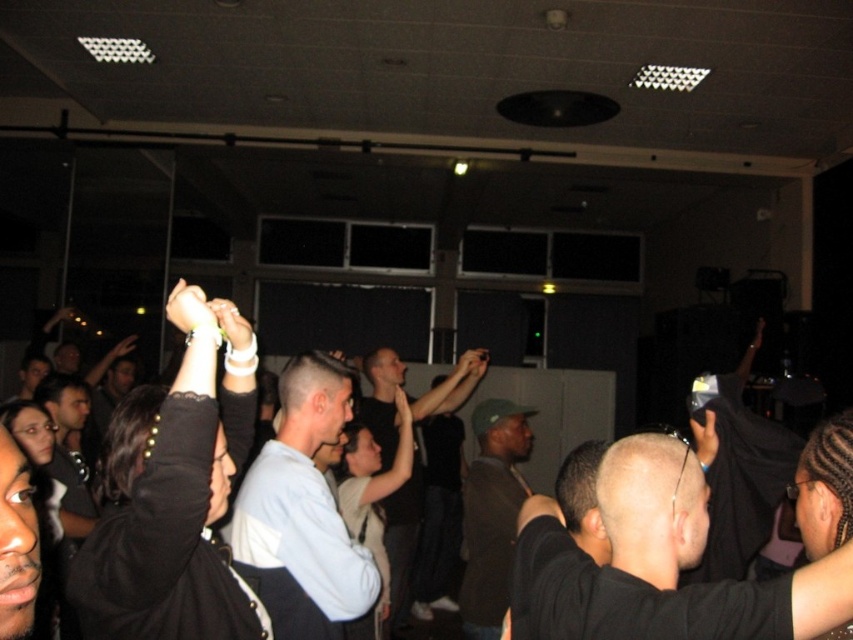
You are standing in the dimly lit room and want to reach a point that is exactly 1.28 meters away from you. Can you reach the point at coordinates point [640,499]?

The point [640,499] is exactly 1.28 meters from the viewer, so yes, you can reach it.